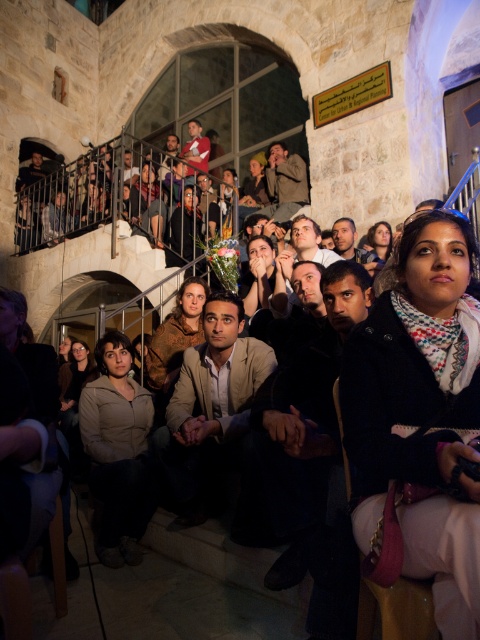
Question: Is smooth brown leather jacket at center to the right of matte red shirt at upper center from the viewer's perspective?

Choices:
 (A) no
 (B) yes

Answer: (B)

Question: Which point appears farthest from the camera in this image?

Choices:
 (A) (153, 385)
 (B) (200, 156)
 (C) (154, 497)

Answer: (B)

Question: Observing the image, what is the correct spatial positioning of smooth brown hair at center in reference to matte red shirt at upper center?

Choices:
 (A) right
 (B) left

Answer: (A)

Question: Which point appears farthest from the camera in this image?

Choices:
 (A) (296, 177)
 (B) (203, 301)

Answer: (A)

Question: Does dark brown leather jacket at center appear over matte beige jacket at center?

Choices:
 (A) yes
 (B) no

Answer: (A)

Question: Based on their relative distances, which object is farther from the dark brown leather jacket at center?

Choices:
 (A) matte black scarf at upper center
 (B) matte black jacket at lower left

Answer: (A)